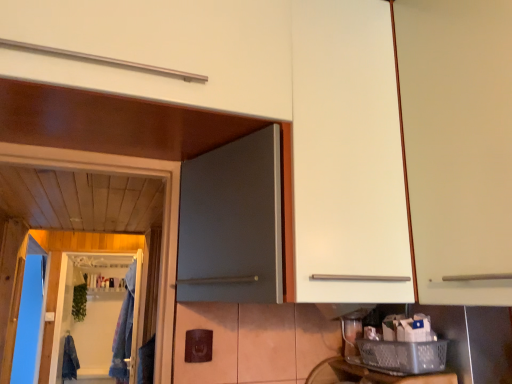
The image size is (512, 384). What do you see at coordinates (458, 145) in the screenshot?
I see `white matte cabinet at right` at bounding box center [458, 145].

The height and width of the screenshot is (384, 512). Identify the location of clear plastic basket at lower right. (404, 356).

What do you see at coordinates (90, 314) in the screenshot? This screenshot has height=384, width=512. I see `clear plastic screen door at lower left` at bounding box center [90, 314].

At what (x,y) coordinates should I click in order to perform the action: click on blue fabric laundry at left, acting as the 2th laundry starting from the left. Please return your answer as a coordinate pair (x, y). This screenshot has width=512, height=384. Looking at the image, I should click on (124, 331).

The image size is (512, 384). I want to click on denim jacket at lower left, which is counted as the second laundry, starting from the front, so pos(70,360).

In order to click on white matte cabinet at right in this screenshot , I will do `click(458, 145)`.

Would you say white matte cabinet at right is part of denim jacket at lower left, positioned as the 1th laundry in back-to-front order,'s contents?

No, white matte cabinet at right is located outside of denim jacket at lower left, positioned as the 1th laundry in back-to-front order.

Does point (67, 335) come farther from viewer compared to point (470, 134)?

Yes, it is behind point (470, 134).

Is denim jacket at lower left, which is counted as the first laundry, starting from the bottom, positioned with its back to white matte cabinet at right?

No.

Locate an element on the screen. This screenshot has width=512, height=384. cabinetry that appears above the denim jacket at lower left, positioned as the 2th laundry in right-to-left order (from a real-world perspective) is located at coordinates (458, 145).

Does clear plastic basket at lower right turn towards denim jacket at lower left, which ranks as the first laundry in left-to-right order?

No, clear plastic basket at lower right is not oriented towards denim jacket at lower left, which ranks as the first laundry in left-to-right order.

Is point (416, 352) less distant than point (72, 376)?

Yes.

Are clear plastic basket at lower right and denim jacket at lower left, positioned as the 1th laundry in back-to-front order, located far from each other?

Yes, clear plastic basket at lower right and denim jacket at lower left, positioned as the 1th laundry in back-to-front order, are located far from each other.

In terms of width, does clear plastic basket at lower right look wider or thinner when compared to denim jacket at lower left, which appears as the second laundry when viewed from the top?

In the image, clear plastic basket at lower right appears to be more narrow than denim jacket at lower left, which appears as the second laundry when viewed from the top.

Who is taller, white matte cabinet at right or metallic silver basket at lower right?

Standing taller between the two is white matte cabinet at right.

Is white matte cabinet at right further to camera compared to metallic silver basket at lower right?

No, white matte cabinet at right is closer to the viewer.

Would you say white matte cabinet at right is to the left or to the right of metallic silver basket at lower right in the picture?

white matte cabinet at right is positioned on metallic silver basket at lower right's right side.

From a real-world perspective, between white matte cabinet at right and metallic silver basket at lower right, who is vertically lower?

metallic silver basket at lower right.

Based on the photo, which object is more forward, clear plastic screen door at lower left or white matte cabinet at right?

white matte cabinet at right is closer to the camera.

From the picture: From a real-world perspective, is clear plastic screen door at lower left physically located above or below white matte cabinet at right?

In terms of real-world spatial position, clear plastic screen door at lower left is below white matte cabinet at right.

From the picture: Would you say clear plastic screen door at lower left is inside or outside white matte cabinet at right?

The correct answer is: outside.

Considering the relative sizes of clear plastic screen door at lower left and white matte cabinet at right in the image provided, is clear plastic screen door at lower left thinner than white matte cabinet at right?

Yes.

Is metallic silver basket at lower right positioned beyond the bounds of denim jacket at lower left, which ranks as the first laundry in left-to-right order?

metallic silver basket at lower right lies outside denim jacket at lower left, which ranks as the first laundry in left-to-right order,'s area.

From the image's perspective, which is above, metallic silver basket at lower right or denim jacket at lower left, which ranks as the first laundry in left-to-right order?

metallic silver basket at lower right, from the image's perspective.

Can you confirm if metallic silver basket at lower right is positioned to the right of denim jacket at lower left, which is counted as the first laundry, starting from the bottom?

Yes, metallic silver basket at lower right is to the right of denim jacket at lower left, which is counted as the first laundry, starting from the bottom.

Measure the distance between metallic silver basket at lower right and denim jacket at lower left, which ranks as the first laundry in left-to-right order.

11.76 feet.

Considering the positions of point (455, 79) and point (124, 301), is point (455, 79) closer or farther from the camera than point (124, 301)?

Point (455, 79) is closer to the camera than point (124, 301).

From a real-world perspective, is white matte cabinet at right positioned under blue fabric laundry at left, acting as the first laundry starting from the top, based on gravity?

Incorrect, from a real-world perspective, white matte cabinet at right is higher than blue fabric laundry at left, acting as the first laundry starting from the top.

From the image's perspective, relative to blue fabric laundry at left, which is the 1th laundry from front to back, is white matte cabinet at right above or below?

white matte cabinet at right is situated higher than blue fabric laundry at left, which is the 1th laundry from front to back, in the image.

Is blue fabric laundry at left, positioned as the second laundry in back-to-front order, directly adjacent to clear plastic screen door at lower left?

blue fabric laundry at left, positioned as the second laundry in back-to-front order, is not next to clear plastic screen door at lower left, and they're not touching.

From a real-world perspective, is blue fabric laundry at left, acting as the 2th laundry starting from the left, above or below clear plastic screen door at lower left?

From a real-world perspective, blue fabric laundry at left, acting as the 2th laundry starting from the left, is physically below clear plastic screen door at lower left.

Considering the sizes of objects blue fabric laundry at left, which appears as the 1th laundry when viewed from the right, and clear plastic screen door at lower left in the image provided, who is bigger, blue fabric laundry at left, which appears as the 1th laundry when viewed from the right, or clear plastic screen door at lower left?

blue fabric laundry at left, which appears as the 1th laundry when viewed from the right, is bigger.

Is blue fabric laundry at left, which is the 1th laundry from front to back, oriented away from clear plastic screen door at lower left?

Absolutely, blue fabric laundry at left, which is the 1th laundry from front to back, is directed away from clear plastic screen door at lower left.

Locate an element on the screen. This screenshot has height=384, width=512. laundry that is the 2nd one below the white matte cabinet at right (from a real-world perspective) is located at coordinates [70, 360].

The height and width of the screenshot is (384, 512). Find the location of `laundry that is the 2nd object to the left of the clear plastic basket at lower right, starting at the anchor`. laundry that is the 2nd object to the left of the clear plastic basket at lower right, starting at the anchor is located at coordinates (70, 360).

From the picture: Looking at the image, which one is located further to white matte cabinet at right, clear plastic basket at lower right or metallic silver basket at lower right?

metallic silver basket at lower right lies further to white matte cabinet at right than the other object.

Looking at the image, which one is located further to metallic silver basket at lower right, denim jacket at lower left, which is counted as the first laundry, starting from the bottom, or clear plastic basket at lower right?

denim jacket at lower left, which is counted as the first laundry, starting from the bottom.

Based on their spatial positions, is metallic silver basket at lower right or blue fabric laundry at left, which appears as the 1th laundry when viewed from the right, further from white matte cabinet at right?

Among the two, blue fabric laundry at left, which appears as the 1th laundry when viewed from the right, is located further to white matte cabinet at right.

Looking at the image, which one is located closer to white matte cabinet at right, metallic silver basket at lower right or clear plastic screen door at lower left?

metallic silver basket at lower right is positioned closer to the anchor white matte cabinet at right.

Looking at the image, which one is located further to clear plastic screen door at lower left, denim jacket at lower left, which ranks as the first laundry in left-to-right order, or white matte cabinet at right?

white matte cabinet at right.

Based on their spatial positions, is blue fabric laundry at left, acting as the 2th laundry starting from the left, or denim jacket at lower left, which ranks as the first laundry in left-to-right order, further from clear plastic screen door at lower left?

blue fabric laundry at left, acting as the 2th laundry starting from the left.

Based on their spatial positions, is clear plastic basket at lower right or blue fabric laundry at left, acting as the first laundry starting from the top, closer to denim jacket at lower left, positioned as the 2th laundry in right-to-left order?

blue fabric laundry at left, acting as the first laundry starting from the top, lies closer to denim jacket at lower left, positioned as the 2th laundry in right-to-left order, than the other object.

Looking at the image, which one is located closer to blue fabric laundry at left, positioned as the second laundry in back-to-front order, white matte cabinet at right or clear plastic basket at lower right?

clear plastic basket at lower right.

Where is `basket between white matte cabinet at right and metallic silver basket at lower right from top to bottom`? Image resolution: width=512 pixels, height=384 pixels. basket between white matte cabinet at right and metallic silver basket at lower right from top to bottom is located at coordinates (404, 356).

Locate an element on the screen. basket positioned between metallic silver basket at lower right and blue fabric laundry at left, arranged as the 2th laundry when ordered from the bottom, from near to far is located at coordinates [404, 356].

Identify the location of basket positioned between metallic silver basket at lower right and clear plastic screen door at lower left from near to far. (404, 356).

Identify the location of counter top positioned between white matte cabinet at right and denim jacket at lower left, positioned as the 1th laundry in back-to-front order, from near to far. The image size is (512, 384). (393, 375).